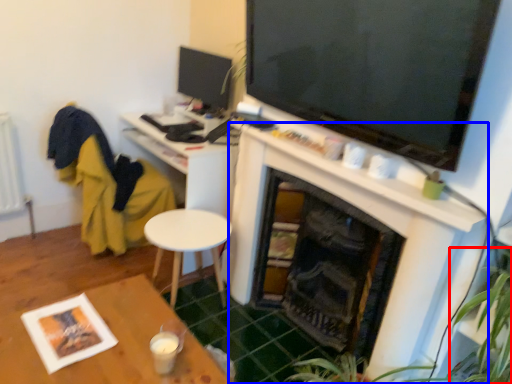
Question: Which object is further to the camera taking this photo, plant (highlighted by a red box) or fireplace (highlighted by a blue box)?

Choices:
 (A) plant
 (B) fireplace

Answer: (B)